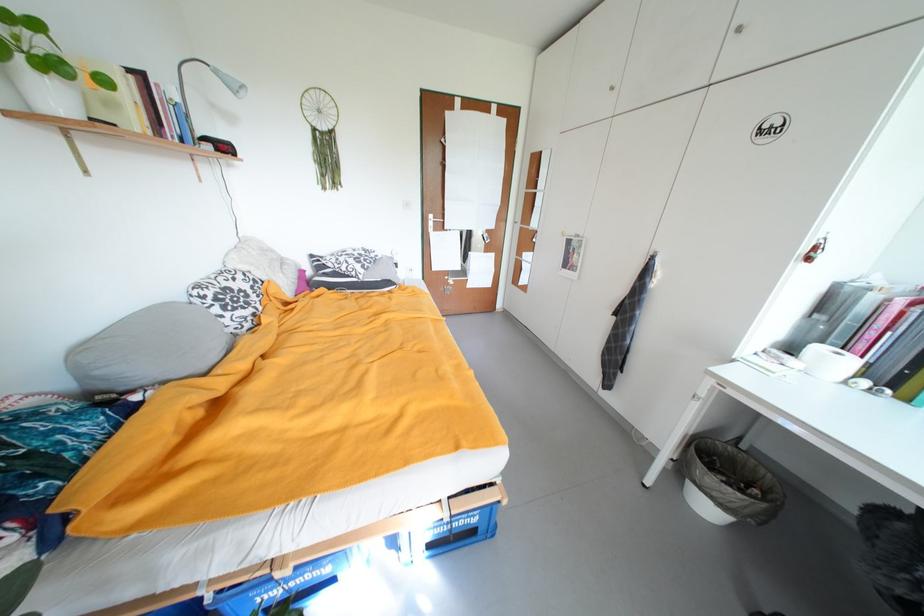
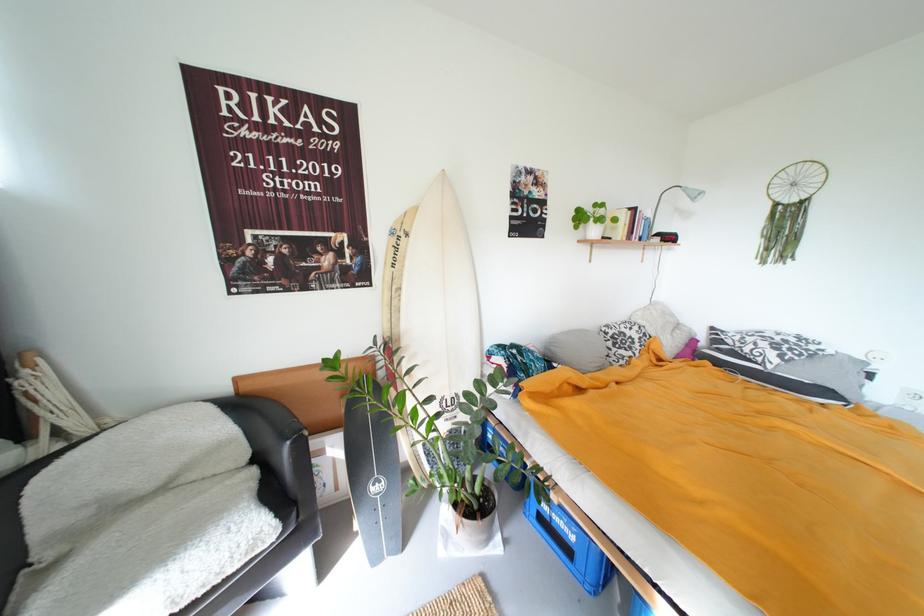
Question: Based on the continuous images, in which direction is the camera rotating? Reply with the corresponding letter.

Choices:
 (A) Left
 (B) Right
 (C) Up
 (D) Down

Answer: (A)